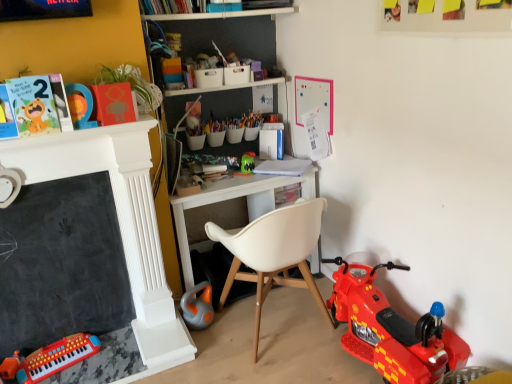
Question: Does shiny plastic toy motorcycle at lower right, the 6th toy in the left-to-right sequence, have a lesser height compared to matte paper card at upper left, which is the 3th book from back to front?

Choices:
 (A) yes
 (B) no

Answer: (B)

Question: Does shiny plastic toy motorcycle at lower right, the 6th toy in the left-to-right sequence, appear on the left side of matte paper card at upper left, which appears as the 3th book when viewed from the right?

Choices:
 (A) yes
 (B) no

Answer: (B)

Question: Is shiny plastic toy motorcycle at lower right, positioned as the first toy in right-to-left order, oriented towards matte paper card at upper left, which appears as the 3th book when viewed from the right?

Choices:
 (A) yes
 (B) no

Answer: (B)

Question: Is matte paper card at upper left, which appears as the 3th book when viewed from the right, surrounded by shiny plastic toy motorcycle at lower right, positioned as the first toy in right-to-left order?

Choices:
 (A) yes
 (B) no

Answer: (B)

Question: Does shiny plastic toy motorcycle at lower right, positioned as the first toy in right-to-left order, have a greater height compared to matte paper card at upper left, the first book from the front?

Choices:
 (A) yes
 (B) no

Answer: (A)

Question: Is shiny plastic toy motorcycle at lower right, the 6th toy in the left-to-right sequence, smaller than matte paper card at upper left, arranged as the first book when viewed from the left?

Choices:
 (A) no
 (B) yes

Answer: (A)

Question: Is matte paper card at upper left, arranged as the first book when viewed from the left, located outside matte plastic number at upper left, the fourth toy from the right?

Choices:
 (A) yes
 (B) no

Answer: (A)

Question: Is matte paper card at upper left, which is the 3th book from back to front, positioned behind matte plastic number at upper left, marked as the third toy in a left-to-right arrangement?

Choices:
 (A) no
 (B) yes

Answer: (A)

Question: Can you confirm if matte paper card at upper left, the first book from the front, is shorter than matte plastic number at upper left, marked as the third toy in a left-to-right arrangement?

Choices:
 (A) yes
 (B) no

Answer: (B)

Question: Can you confirm if matte paper card at upper left, the first book from the front, is taller than matte plastic number at upper left, marked as the third toy in a left-to-right arrangement?

Choices:
 (A) yes
 (B) no

Answer: (A)

Question: From the image's perspective, does matte paper card at upper left, the first book from the front, appear higher than matte plastic number at upper left, the fourth toy from the right?

Choices:
 (A) no
 (B) yes

Answer: (A)

Question: Is matte paper card at upper left, which is the 3th book from back to front, not close to matte plastic number at upper left, marked as the third toy in a left-to-right arrangement?

Choices:
 (A) no
 (B) yes

Answer: (A)

Question: From the image's perspective, would you say black chalkboard at left is positioned over matte paper card at upper left, arranged as the first book when viewed from the left?

Choices:
 (A) yes
 (B) no

Answer: (B)